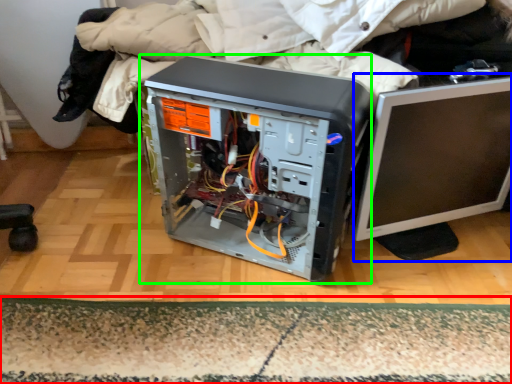
Question: Which object is positioned closest to mat (highlighted by a red box)? Select from computer monitor (highlighted by a blue box) and computer tower (highlighted by a green box).

Choices:
 (A) computer monitor
 (B) computer tower

Answer: (B)